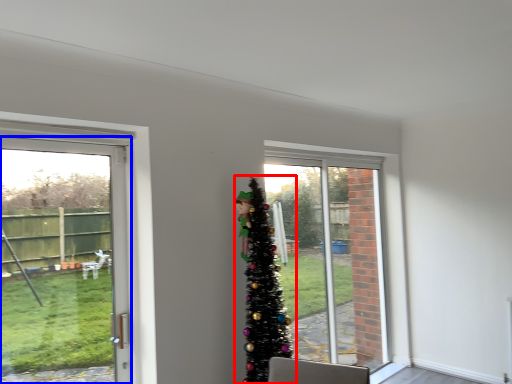
Question: Among these objects, which one is farthest to the camera, christmas tree (highlighted by a red box) or door (highlighted by a blue box)?

Choices:
 (A) christmas tree
 (B) door

Answer: (A)